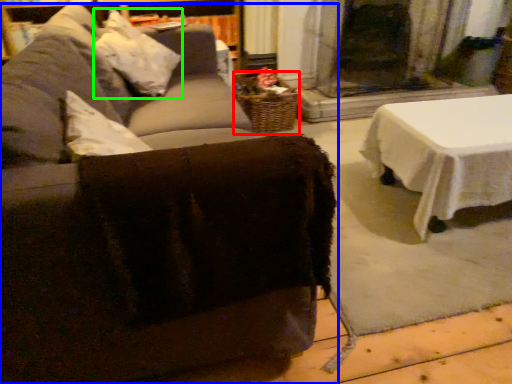
Question: Which is nearer to the basket (highlighted by a red box)? studio couch (highlighted by a blue box) or pillow (highlighted by a green box).

Choices:
 (A) studio couch
 (B) pillow

Answer: (B)